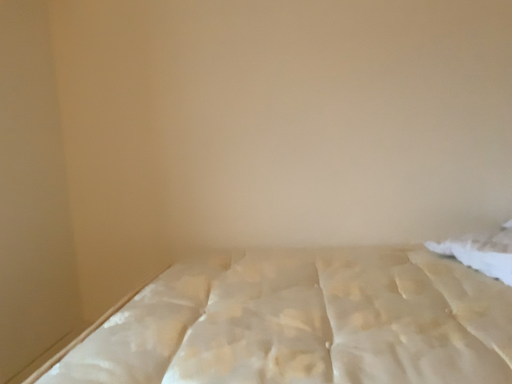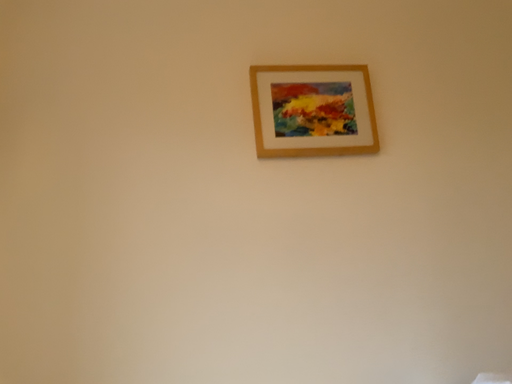
Question: Which way did the camera rotate in the video?

Choices:
 (A) rotated right
 (B) rotated left

Answer: (A)